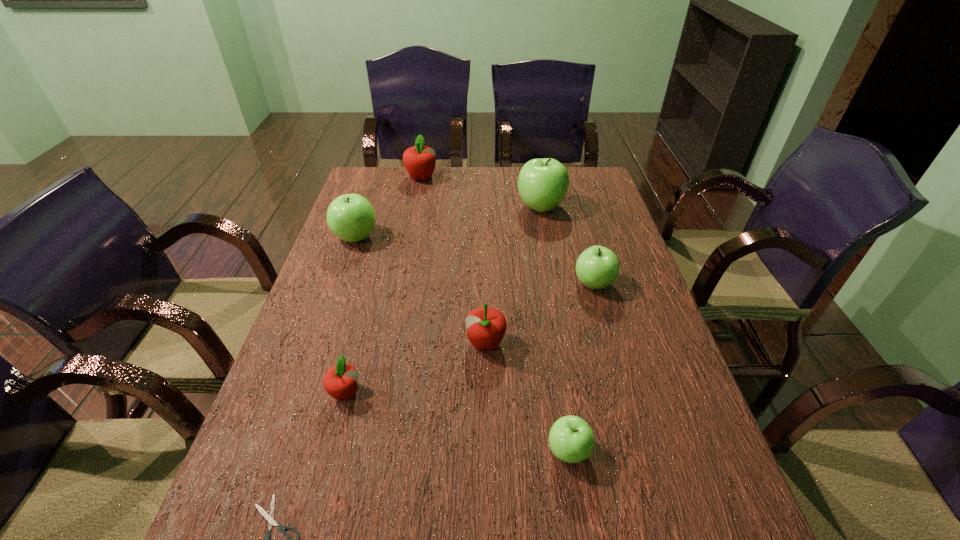
Where is `vacant space positioned on the back of the nearest green apple`? vacant space positioned on the back of the nearest green apple is located at coordinates (545, 299).

You are a GUI agent. You are given a task and a screenshot of the screen. Output one action in this format:
    pyautogui.click(x=<x>, y=<y>)
    Task: Click on the object at the far right corner
    
    Given the screenshot: What is the action you would take?
    pyautogui.click(x=543, y=183)

Where is `free space at the far edge of the desktop`? free space at the far edge of the desktop is located at coordinates (402, 180).

I want to click on blank space at the left edge of the desktop, so click(x=228, y=517).

Find the location of a particular element. Image resolution: width=960 pixels, height=540 pixels. vacant space at the right edge of the desktop is located at coordinates (636, 326).

In order to click on vacant space at the far left corner of the desktop in this screenshot , I will do `click(372, 195)`.

The width and height of the screenshot is (960, 540). Identify the location of free spot at the far right corner of the desktop. (573, 191).

Where is `empty space that is in between the farthest green apple and the fourth farthest apple`? This screenshot has height=540, width=960. empty space that is in between the farthest green apple and the fourth farthest apple is located at coordinates (567, 245).

Where is `vacant area that lies between the rightmost red apple and the nearest green apple`? The height and width of the screenshot is (540, 960). vacant area that lies between the rightmost red apple and the nearest green apple is located at coordinates (527, 397).

Where is `free space between the fifth farthest object and the nearest green apple`? This screenshot has height=540, width=960. free space between the fifth farthest object and the nearest green apple is located at coordinates (527, 397).